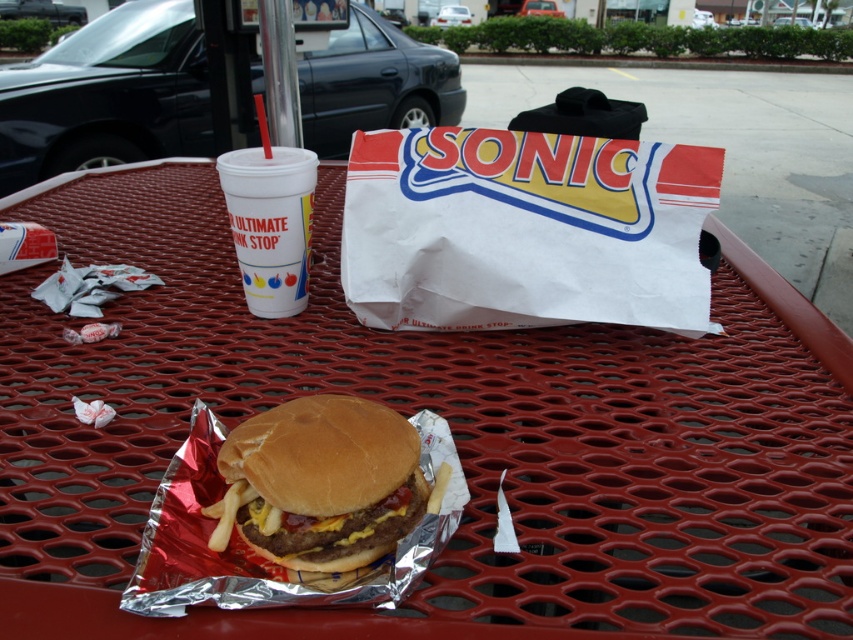
Question: Does brown toasted bun at center lie behind white styrofoam cup at center?

Choices:
 (A) no
 (B) yes

Answer: (A)

Question: Which point is closer to the camera taking this photo?

Choices:
 (A) (383, 525)
 (B) (306, 237)

Answer: (A)

Question: Among these points, which one is nearest to the camera?

Choices:
 (A) (276, 420)
 (B) (231, 180)

Answer: (A)

Question: Can you confirm if brown toasted bun at center is wider than white styrofoam cup at center?

Choices:
 (A) no
 (B) yes

Answer: (B)

Question: Is brown toasted bun at center above white styrofoam cup at center?

Choices:
 (A) yes
 (B) no

Answer: (B)